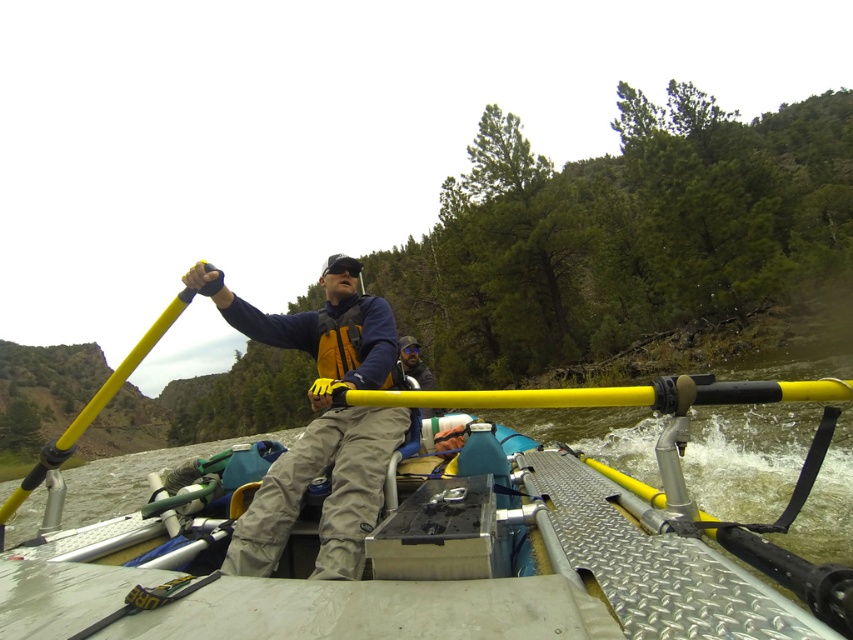
Between metallic diamond plate boat at center and matte yellow paddle at upper left, which one appears on the right side from the viewer's perspective?

metallic diamond plate boat at center

Who is more forward, (811, 630) or (328, 298)?

Point (811, 630)

The height and width of the screenshot is (640, 853). I want to click on metallic diamond plate boat at center, so click(424, 572).

How far apart are matte yellow paddle at upper left and yellow plastic paddle at upper center?

A distance of 4.04 feet exists between matte yellow paddle at upper left and yellow plastic paddle at upper center.

Can you confirm if matte yellow paddle at upper left is wider than yellow plastic paddle at upper center?

No, matte yellow paddle at upper left is not wider than yellow plastic paddle at upper center.

What do you see at coordinates (321, 420) in the screenshot? I see `matte yellow paddle at upper left` at bounding box center [321, 420].

You are a GUI agent. You are given a task and a screenshot of the screen. Output one action in this format:
    pyautogui.click(x=<x>, y=<y>)
    Task: Click on the matte yellow paddle at upper left
    
    Given the screenshot: What is the action you would take?
    pyautogui.click(x=321, y=420)

Which of these two, metallic diamond plate boat at center or yellow plastic paddle at upper center, stands shorter?

With less height is metallic diamond plate boat at center.

Between point (778, 618) and point (171, 321), which one is positioned behind?

The point (171, 321) is behind.

Which is behind, point (651, 545) or point (131, 353)?

The point (131, 353) is behind.

The height and width of the screenshot is (640, 853). I want to click on metallic diamond plate boat at center, so click(x=424, y=572).